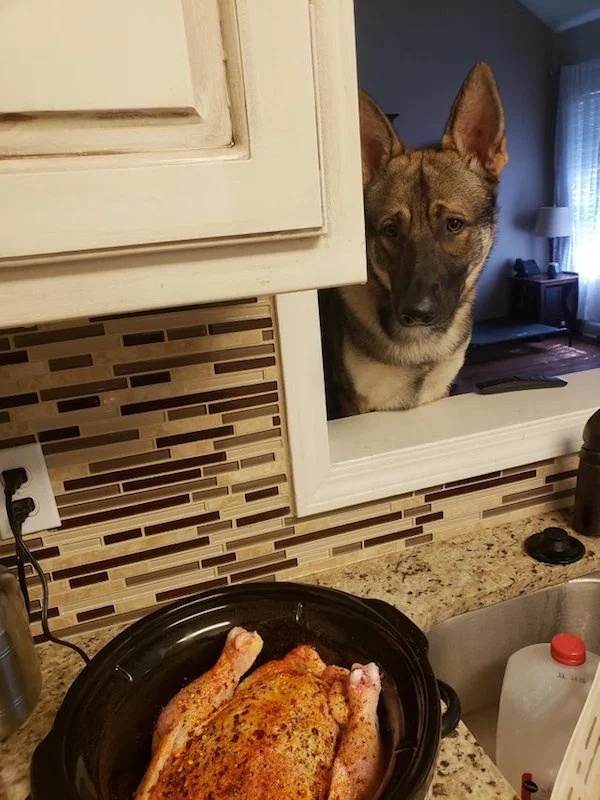
The image size is (600, 800). Find the location of `sink`. sink is located at coordinates (471, 670).